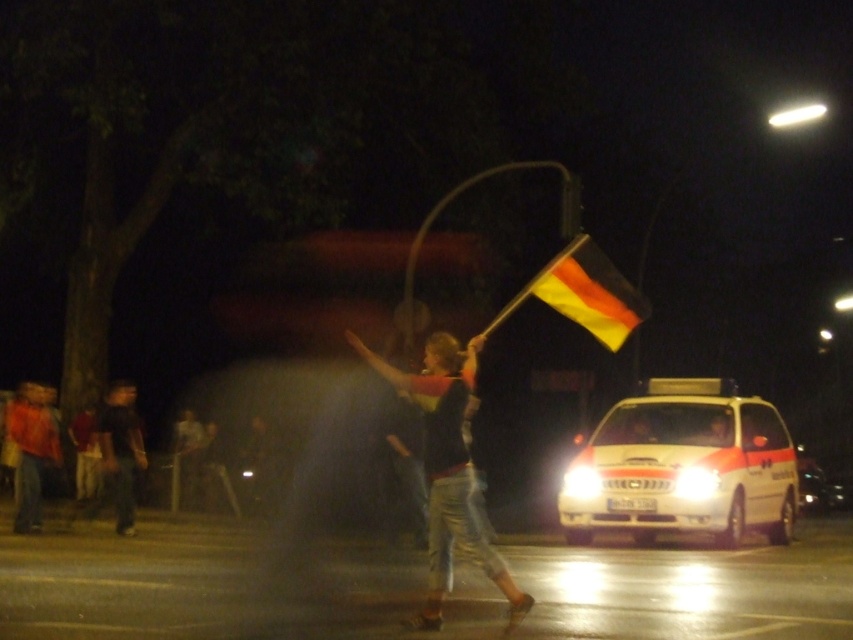
Question: Estimate the real-world distances between objects in this image. Which object is farther from the white glossy ambulance at center?

Choices:
 (A) yellow-orange fabric flag at upper right
 (B) dark gray jeans at left
 (C) matte black shirt at center

Answer: (B)

Question: Does yellow-orange fabric flag at upper right appear on the left side of dark gray jeans at left?

Choices:
 (A) no
 (B) yes

Answer: (A)

Question: Is white glossy ambulance at center positioned before yellow-orange fabric flag at upper right?

Choices:
 (A) yes
 (B) no

Answer: (B)

Question: Which of the following is the closest to the observer?

Choices:
 (A) yellow-orange fabric flag at upper right
 (B) matte black shirt at center
 (C) dark gray jeans at left

Answer: (B)

Question: Does white glossy ambulance at center appear over dark gray jeans at left?

Choices:
 (A) yes
 (B) no

Answer: (B)

Question: Which object appears farthest from the camera in this image?

Choices:
 (A) dark gray jeans at left
 (B) yellow-orange fabric flag at upper right
 (C) white glossy ambulance at center
 (D) matte black shirt at center

Answer: (A)